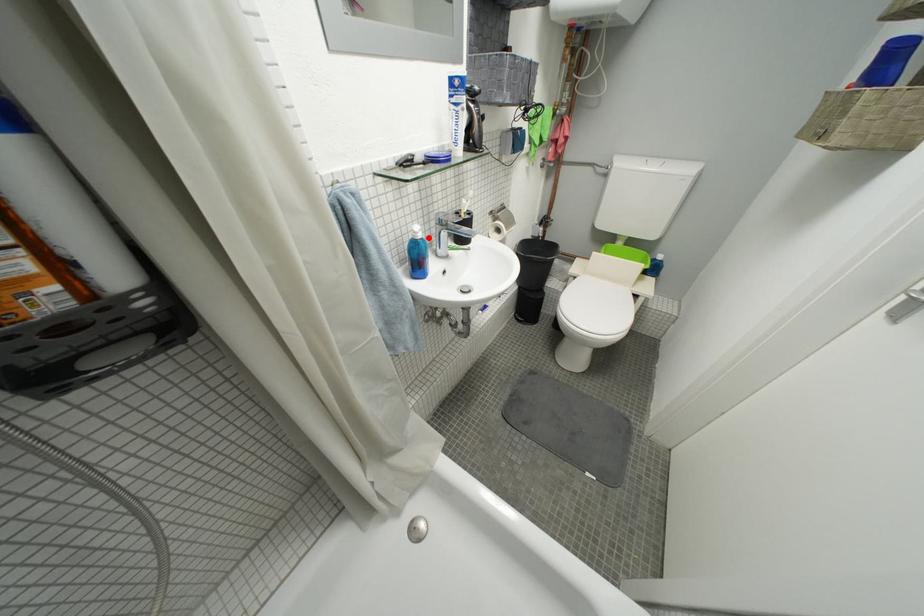
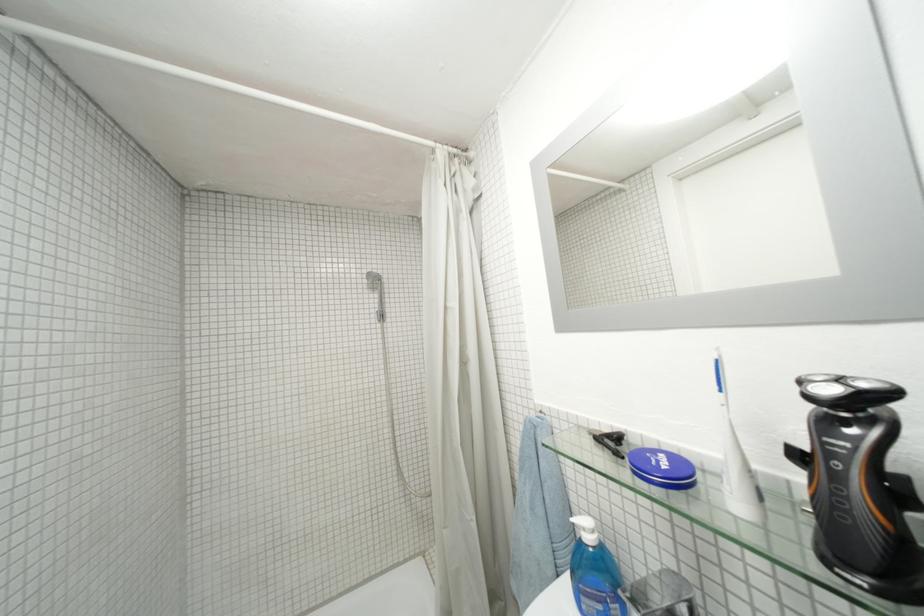
Question: I am providing you with two images of the same scene from different viewpoints. Given a red point in image1, look at the same physical point in image2. Is it:

Choices:
 (A) Closer to the viewpoint
 (B) Farther from the viewpoint

Answer: (B)